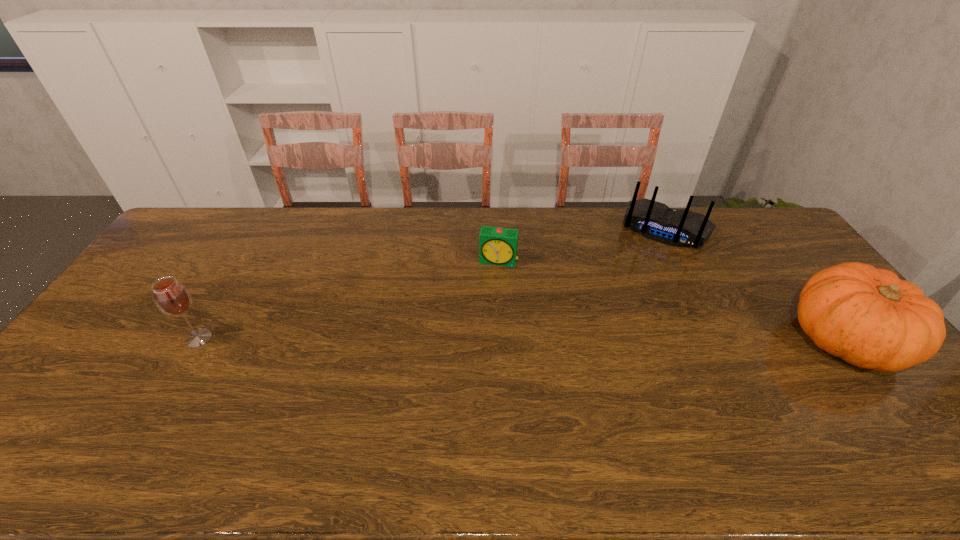
Locate an element on the screen. wineglass is located at coordinates coord(171,297).

Identify the location of pumpkin. (868, 317).

The image size is (960, 540). Identify the location of the second object from right to left. (656, 221).

The height and width of the screenshot is (540, 960). I want to click on the third object from right to left, so click(498, 246).

Find the location of a particular element. The height and width of the screenshot is (540, 960). the shortest object is located at coordinates (498, 246).

Where is `free space located on the back of the wineglass`? Image resolution: width=960 pixels, height=540 pixels. free space located on the back of the wineglass is located at coordinates (255, 244).

You are a GUI agent. You are given a task and a screenshot of the screen. Output one action in this format:
    pyautogui.click(x=<x>, y=<y>)
    Task: Click on the vacant area situated 0.350m on the left of the rightmost object
    Image resolution: width=960 pixels, height=540 pixels.
    Given the screenshot: What is the action you would take?
    pyautogui.click(x=664, y=340)

Image resolution: width=960 pixels, height=540 pixels. What are the coordinates of `vacant region located 0.260m on the back of the third object from left to right` in the screenshot? It's located at (632, 299).

Find the location of a particular element. This screenshot has height=540, width=960. vacant space positioned 0.310m on the back of the third object from left to right is located at coordinates (627, 309).

Where is `vacant area situated 0.220m on the back of the third object from left to right`? The width and height of the screenshot is (960, 540). vacant area situated 0.220m on the back of the third object from left to right is located at coordinates (636, 291).